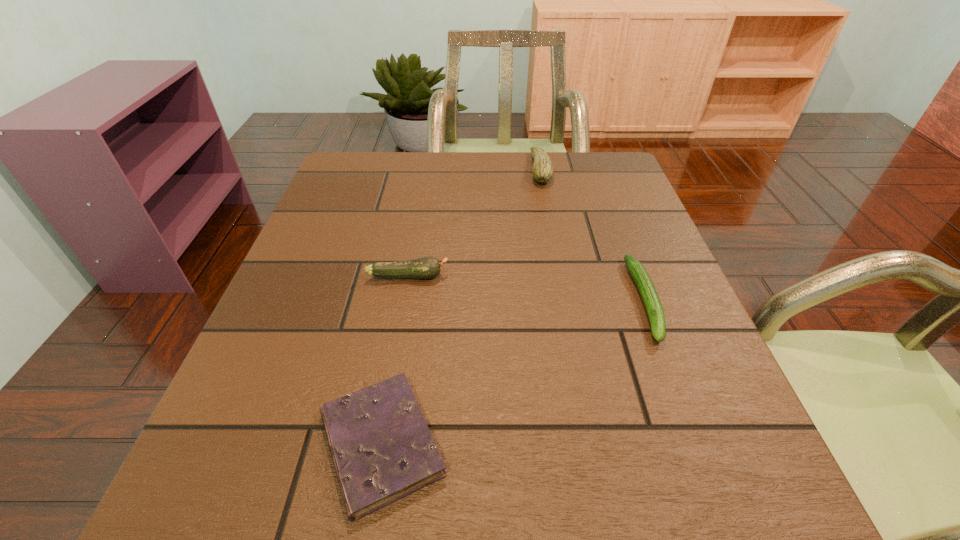
Where is `free space between the shortest zucchini and the second tallest zucchini`? free space between the shortest zucchini and the second tallest zucchini is located at coordinates (527, 288).

Where is `free space between the rightmost zucchini and the leftmost zucchini`? free space between the rightmost zucchini and the leftmost zucchini is located at coordinates (527, 288).

This screenshot has width=960, height=540. Find the location of `vacant area that lies between the tallest object and the nearest object`. vacant area that lies between the tallest object and the nearest object is located at coordinates (461, 307).

Where is `free spot between the nearest object and the leftmost zucchini`? The height and width of the screenshot is (540, 960). free spot between the nearest object and the leftmost zucchini is located at coordinates pyautogui.click(x=395, y=360).

Image resolution: width=960 pixels, height=540 pixels. Find the location of `free space between the second tallest zucchini and the second object from right to left`. free space between the second tallest zucchini and the second object from right to left is located at coordinates (474, 222).

Identify the location of the closest object to the third shortest object. The image size is (960, 540). (382, 449).

Locate which object ranks third in proximity to the rightmost zucchini. Please provide its 2D coordinates. Your answer should be formatted as a tuple, i.e. [(x, y)], where the tuple contains the x and y coordinates of a point satisfying the conditions above.

[(426, 267)]

Find the location of a particular element. The height and width of the screenshot is (540, 960). zucchini that stands as the closest to the rightmost zucchini is located at coordinates (542, 170).

Identify the location of the second closest zucchini relative to the second zucchini from left to right. The width and height of the screenshot is (960, 540). (426, 267).

Find the location of a particular element. The height and width of the screenshot is (540, 960). vacant space that satisfies the following two spatial constraints: 1. at the blossom end of the leftmost zucchini; 2. on the back side of the shortest object is located at coordinates (378, 444).